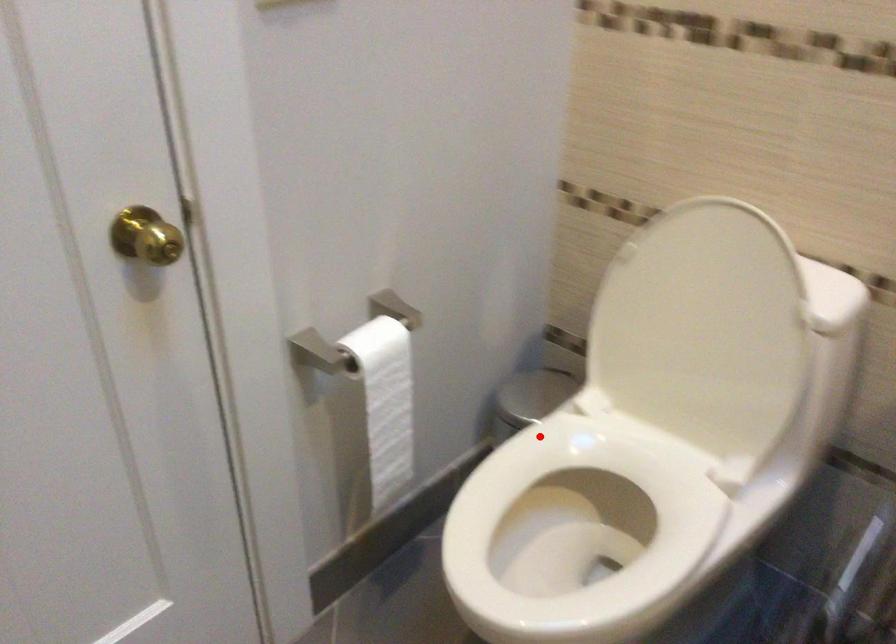
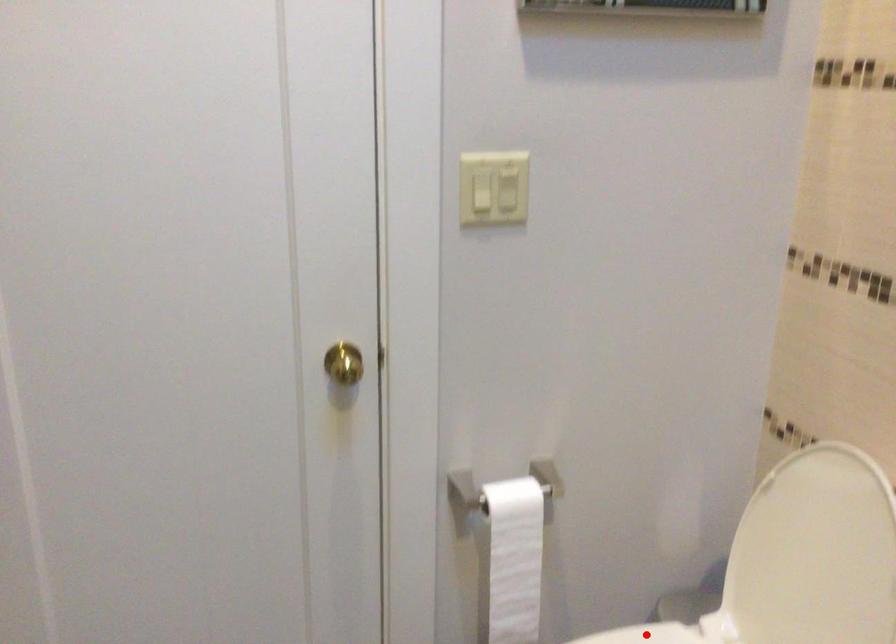
I am providing you with two images of the same scene from different viewpoints. A red point is marked on the first image and another point is marked on the second image. Do the highlighted points in image1 and image2 indicate the same real-world spot?

Yes